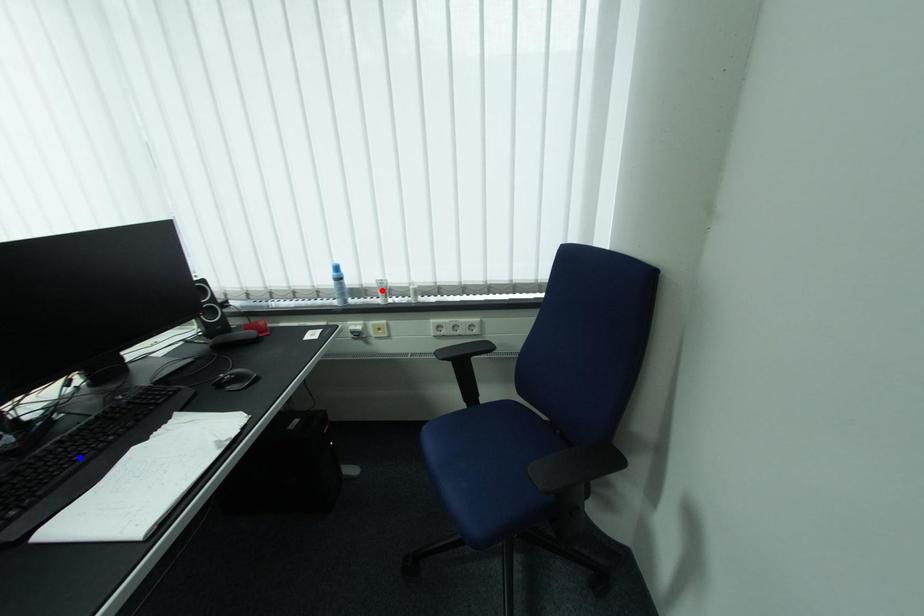
Question: In the image, two points are highlighted. Which point is nearer to the camera? Reply with the corresponding letter.

Choices:
 (A) blue point
 (B) red point

Answer: (A)